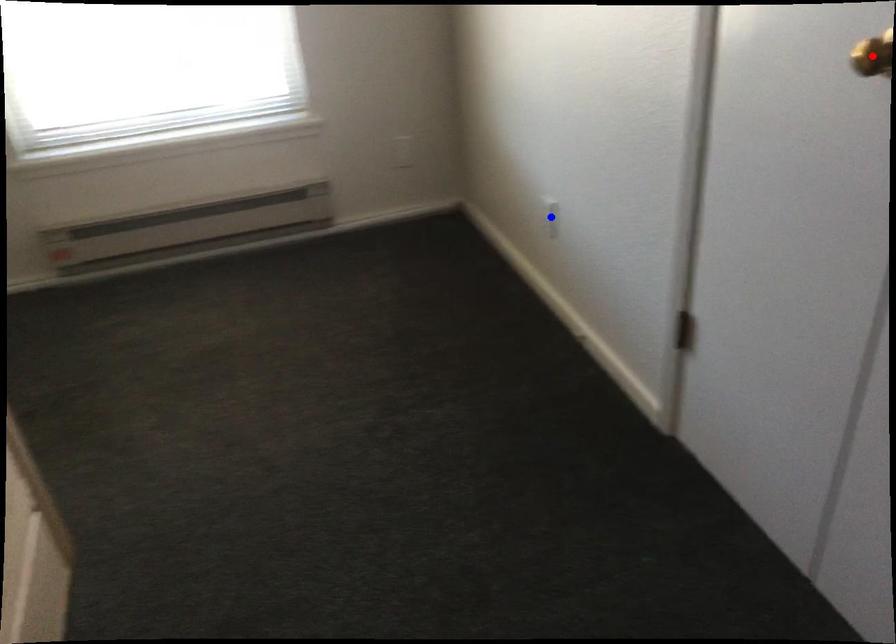
Question: Two points are marked on the image. Which point is closer to the camera?

Choices:
 (A) Blue point is closer.
 (B) Red point is closer.

Answer: (B)